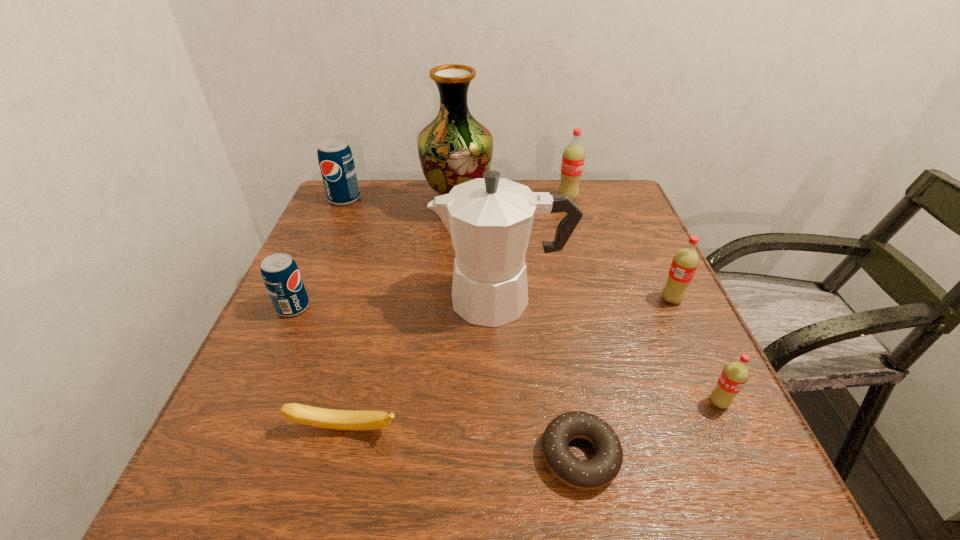
The image size is (960, 540). I want to click on free location located on the back of the second nearest red soda, so click(646, 246).

Locate an element on the screen. The image size is (960, 540). free location located 0.050m on the front of the nearer blue pop is located at coordinates click(x=279, y=338).

Where is `vacant space situated on the left of the nearest soda`? The height and width of the screenshot is (540, 960). vacant space situated on the left of the nearest soda is located at coordinates (654, 402).

At what (x,y) coordinates should I click in order to perform the action: click on vacant space situated 0.070m at the stem of the yellow banana. Please return your answer as a coordinate pair (x, y). This screenshot has height=540, width=960. Looking at the image, I should click on (331, 487).

Image resolution: width=960 pixels, height=540 pixels. Identify the location of blank area located on the back of the shortest object. (561, 352).

Identify the location of vase at the far edge. (455, 148).

The width and height of the screenshot is (960, 540). Find the location of `object at the near edge`. object at the near edge is located at coordinates (595, 473).

Find the location of a particular element. banana that is at the left edge is located at coordinates (313, 416).

I want to click on object that is at the far left corner, so click(x=335, y=158).

I want to click on object that is at the far right corner, so click(x=573, y=157).